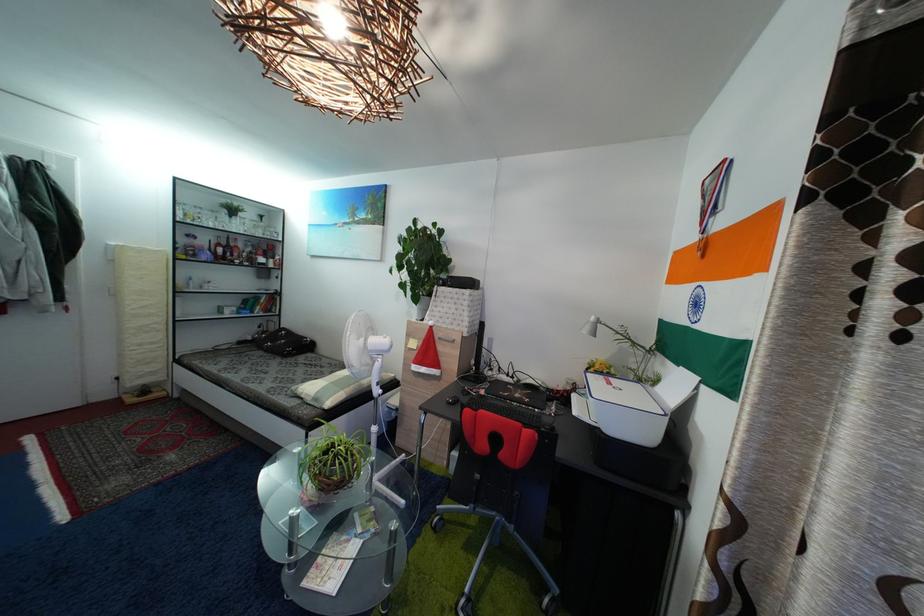
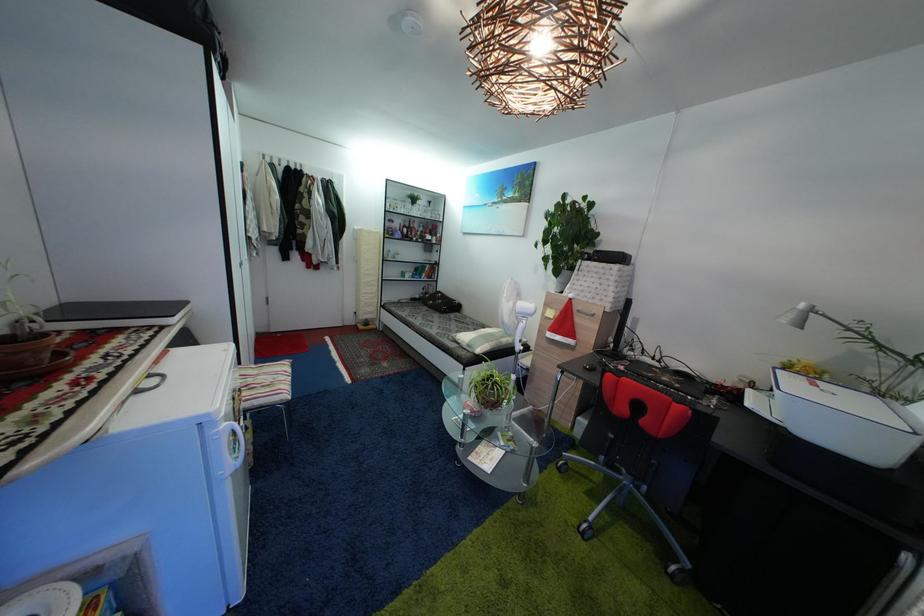
In a continuous first-person perspective shot, in which direction is the camera moving?

The movement direction of the cameraman is left, backward.